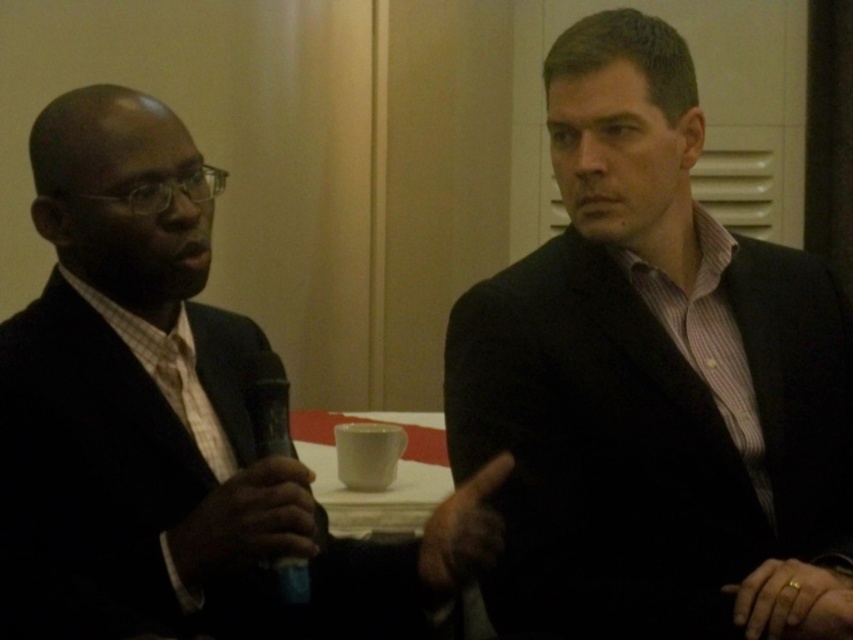
Can you confirm if black matte microphone at left is taller than gold metallic ring at lower right?

Yes, black matte microphone at left is taller than gold metallic ring at lower right.

Does black matte microphone at left have a larger size compared to gold metallic ring at lower right?

Correct, black matte microphone at left is larger in size than gold metallic ring at lower right.

Which is behind, point (241, 472) or point (838, 572)?

The point (838, 572) is more distant.

Identify the location of black matte microphone at left. The width and height of the screenshot is (853, 640). (247, 522).

Is point (613, 348) in front of point (447, 544)?

No, it is not.

Who is positioned more to the left, matte black suit at center or brown leather hand at center?

brown leather hand at center is more to the left.

The height and width of the screenshot is (640, 853). I want to click on matte black suit at center, so click(648, 372).

This screenshot has height=640, width=853. What do you see at coordinates (154, 419) in the screenshot? I see `matte black suit at left` at bounding box center [154, 419].

Is point (1, 556) positioned behind point (791, 596)?

No, it is in front of (791, 596).

Between point (225, 426) and point (785, 582), which one is positioned behind?

Positioned behind is point (225, 426).

Locate an element on the screen. Image resolution: width=853 pixels, height=640 pixels. matte black suit at left is located at coordinates (154, 419).